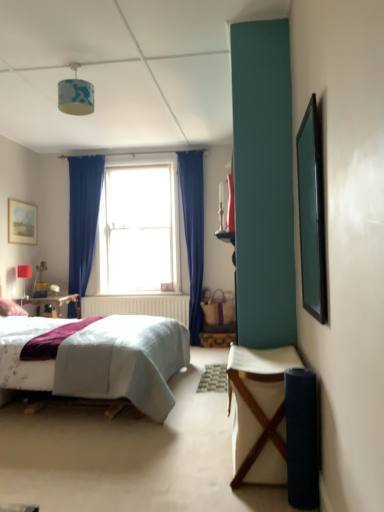
Question: Considering the relative positions of green matte picture frame at right, positioned as the second picture frame in back-to-front order, and matte red lampshade at upper left, acting as the 1th lamp starting from the back, in the image provided, is green matte picture frame at right, positioned as the second picture frame in back-to-front order, in front of matte red lampshade at upper left, acting as the 1th lamp starting from the back,?

Choices:
 (A) no
 (B) yes

Answer: (B)

Question: Would you say green matte picture frame at right, placed as the second picture frame when sorted from left to right, is outside matte red lampshade at upper left, the 2th lamp from the front?

Choices:
 (A) no
 (B) yes

Answer: (B)

Question: Could you tell me if green matte picture frame at right, which is the first picture frame in right-to-left order, is turned towards matte red lampshade at upper left, marked as the second lamp in a top-to-bottom arrangement?

Choices:
 (A) no
 (B) yes

Answer: (A)

Question: From the image's perspective, is green matte picture frame at right, arranged as the first picture frame when viewed from the front, over matte red lampshade at upper left, arranged as the first lamp when viewed from the left?

Choices:
 (A) yes
 (B) no

Answer: (A)

Question: Is green matte picture frame at right, positioned as the second picture frame in back-to-front order, placed right next to matte red lampshade at upper left, which is counted as the first lamp, starting from the bottom?

Choices:
 (A) yes
 (B) no

Answer: (B)

Question: Considering the positions of matte wooden picture frame at upper left, positioned as the second picture frame in front-to-back order, and white fabric desk at lower right in the image, is matte wooden picture frame at upper left, positioned as the second picture frame in front-to-back order, wider or thinner than white fabric desk at lower right?

Choices:
 (A) thin
 (B) wide

Answer: (A)

Question: From a real-world perspective, is matte wooden picture frame at upper left, the 2th picture frame positioned from the right, above or below white fabric desk at lower right?

Choices:
 (A) below
 (B) above

Answer: (B)

Question: Is matte wooden picture frame at upper left, the 2th picture frame positioned from the right, situated inside white fabric desk at lower right or outside?

Choices:
 (A) inside
 (B) outside

Answer: (B)

Question: Visually, is matte wooden picture frame at upper left, the first picture frame in the left-to-right sequence, positioned to the left or to the right of white fabric desk at lower right?

Choices:
 (A) left
 (B) right

Answer: (A)

Question: Is clear glass window at center taller or shorter than green matte picture frame at right, which is the first picture frame in right-to-left order?

Choices:
 (A) tall
 (B) short

Answer: (A)

Question: Considering the positions of clear glass window at center and green matte picture frame at right, placed as the second picture frame when sorted from left to right, in the image, is clear glass window at center bigger or smaller than green matte picture frame at right, placed as the second picture frame when sorted from left to right,?

Choices:
 (A) small
 (B) big

Answer: (B)

Question: In terms of width, does clear glass window at center look wider or thinner when compared to green matte picture frame at right, positioned as the second picture frame in back-to-front order?

Choices:
 (A) wide
 (B) thin

Answer: (A)

Question: Does point (125, 242) appear closer or farther from the camera than point (302, 215)?

Choices:
 (A) closer
 (B) farther

Answer: (B)

Question: From their relative heights in the image, would you say brown woven picnic basket at center-right is taller or shorter than white fabric desk at lower right?

Choices:
 (A) short
 (B) tall

Answer: (A)

Question: Is point (223, 321) positioned closer to the camera than point (281, 440)?

Choices:
 (A) closer
 (B) farther

Answer: (B)